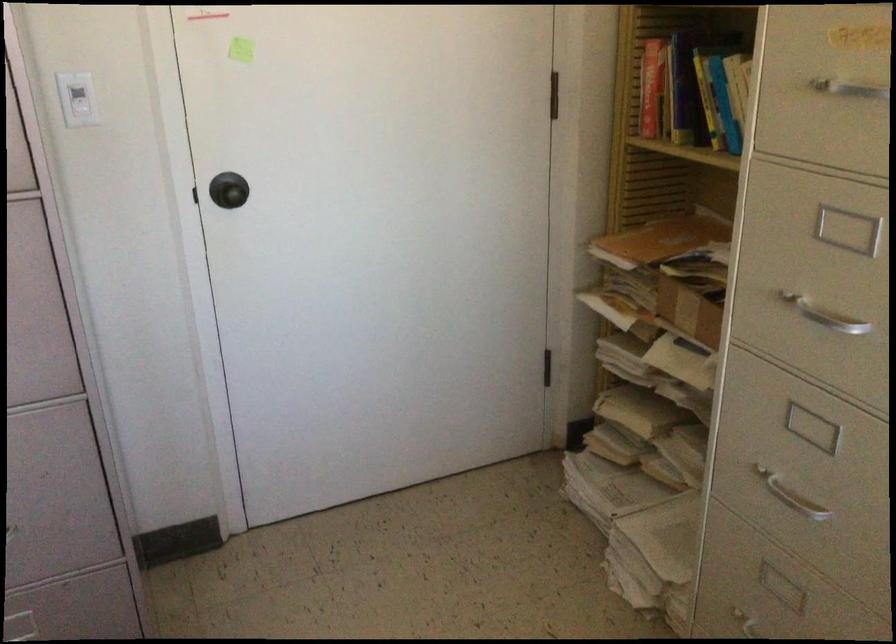
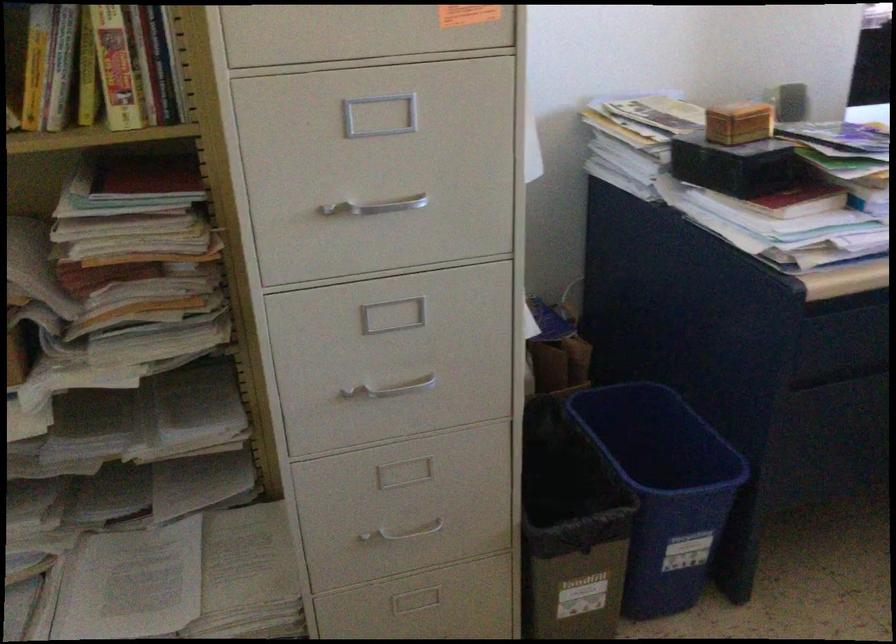
The images are taken continuously from a first-person perspective. In which direction is your viewpoint rotating?

The camera rotated toward right-down.